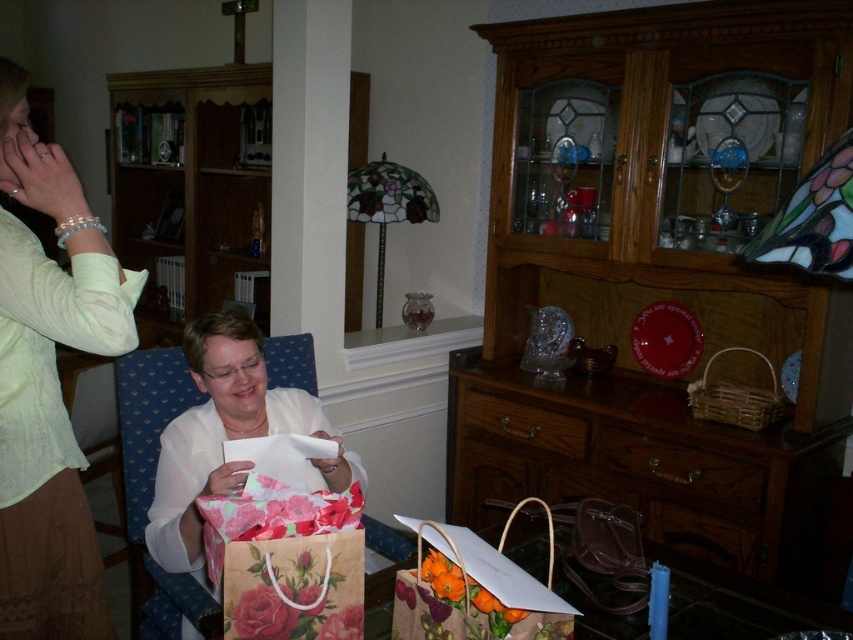
What is the color and type of clothing worn by the person at the coordinates point (x=49, y=384)?

The person at point (x=49, y=384) is wearing a light green fabric shirt.

You are a delivery person who needs to place a package that is 16 inches long between the light green fabric shirt at upper left and the floral paper bag at center. Can you fit the package between them without moving either object?

The distance between the light green fabric shirt at upper left and the floral paper bag at center is 16.59 inches. Since the package is 16 inches long, it can fit between them as the available space is slightly larger than the package.

You are organizing a gift delivery and need to ensure the items fit in a box. The light green fabric shirt at upper left and the floral paper bag at center must both be placed inside. Which item requires more space in the box?

The floral paper bag at center requires more space in the box because it is larger than the light green fabric shirt at upper left.